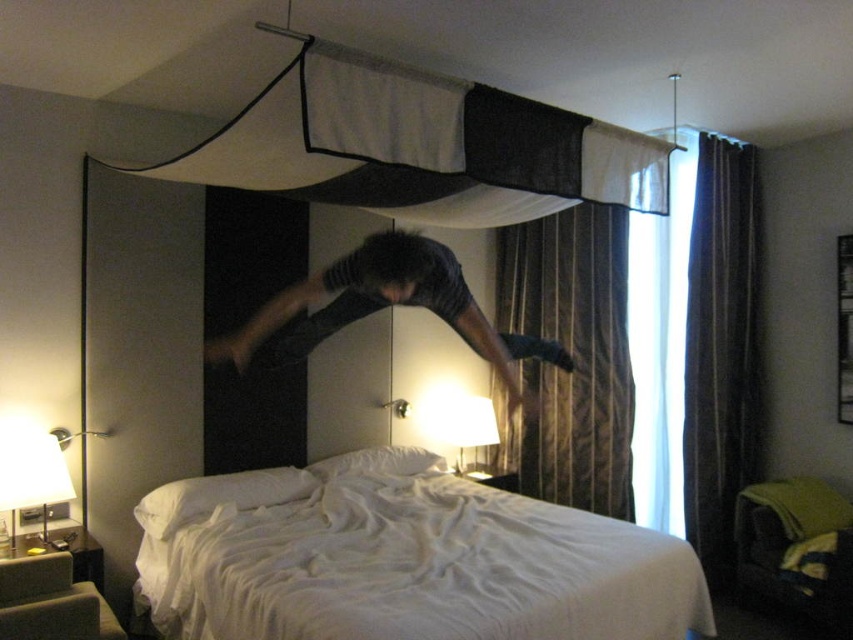
Question: Can you confirm if brown striped curtain at center is thinner than dark gray fabric at center?

Choices:
 (A) yes
 (B) no

Answer: (A)

Question: Which point appears closest to the camera in this image?

Choices:
 (A) (560, 449)
 (B) (200, 497)
 (C) (744, 451)
 (D) (247, 328)

Answer: (B)

Question: Which object is the closest to the white fabric canopy at upper center?

Choices:
 (A) dark fabric curtain at right
 (B) white soft bed at center
 (C) brown striped curtain at center

Answer: (B)

Question: Does white soft bed at center have a lesser width compared to brown striped curtain at center?

Choices:
 (A) no
 (B) yes

Answer: (A)

Question: Is white fabric canopy at upper center thinner than brown striped curtain at center?

Choices:
 (A) yes
 (B) no

Answer: (B)

Question: Which object is farther from the camera taking this photo?

Choices:
 (A) brown striped curtain at center
 (B) dark fabric curtain at right

Answer: (A)